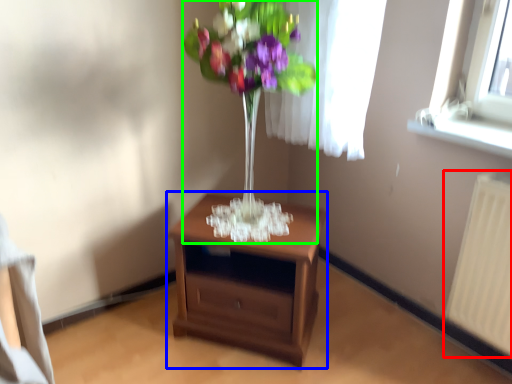
Question: Which object is positioned closest to radiator (highlighted by a red box)? Select from nightstand (highlighted by a blue box) and floral arrangement (highlighted by a green box).

Choices:
 (A) nightstand
 (B) floral arrangement

Answer: (A)